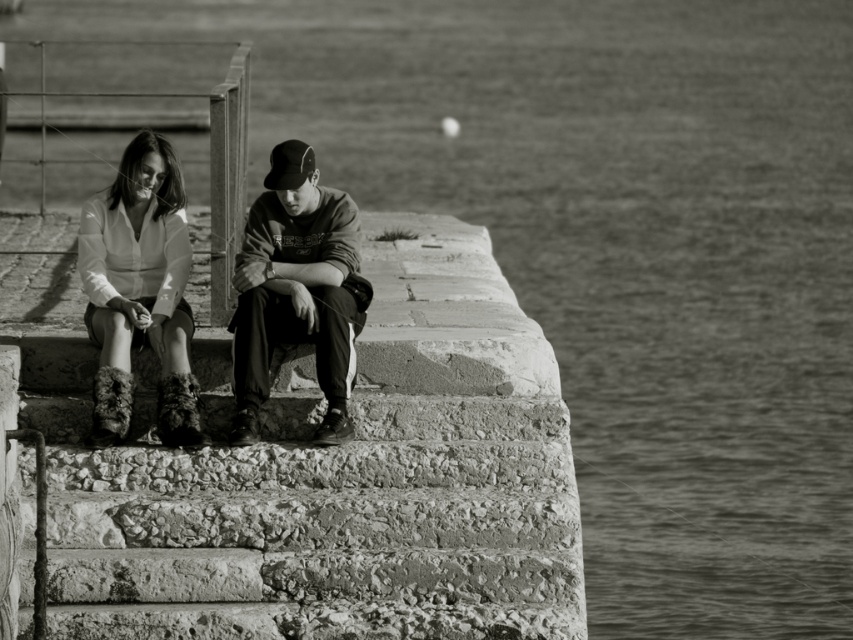
You are standing at the bottom of the rough stone stairs at center. If you walk straight ahead, will you reach the woman or the man first?

The rough stone stairs at center is located at point (306, 516), so the man is closer to the stairs and will be reached first.

You are a photographer analyzing the composition of this black and white photo. You notice the dark gray sweatshirt at center and the fuzzy fabric boots at lower left. Which object is positioned higher in the image?

The dark gray sweatshirt at center is located above the fuzzy fabric boots at lower left, so it is positioned higher in the image.